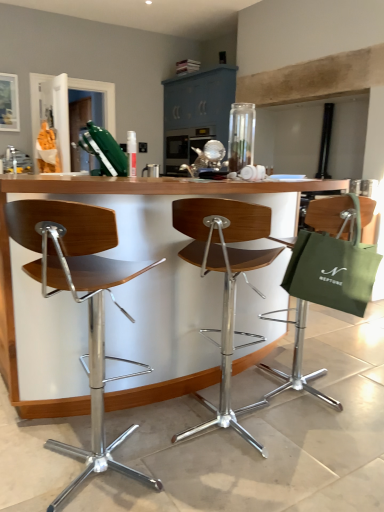
Question: From a real-world perspective, is wooden seat at center, which is counted as the 2th chair, starting from the right, on top of green canvas tote at right?

Choices:
 (A) yes
 (B) no

Answer: (B)

Question: Are wooden seat at center, which is counted as the 2th chair, starting from the right, and green canvas tote at right making contact?

Choices:
 (A) no
 (B) yes

Answer: (A)

Question: Is wooden seat at center, which is counted as the 2th chair, starting from the right, not close to green canvas tote at right?

Choices:
 (A) no
 (B) yes

Answer: (A)

Question: From a real-world perspective, is wooden seat at center, which is counted as the second chair, starting from the left, below green canvas tote at right?

Choices:
 (A) yes
 (B) no

Answer: (A)

Question: Is wooden seat at center, which is counted as the second chair, starting from the left, bigger than green canvas tote at right?

Choices:
 (A) yes
 (B) no

Answer: (A)

Question: Would you say green fabric bag at right, which appears as the first chair when viewed from the right, is to the left or to the right of wooden seat at center, acting as the third chair starting from the right, in the picture?

Choices:
 (A) right
 (B) left

Answer: (A)

Question: Is point (357, 266) positioned closer to the camera than point (26, 246)?

Choices:
 (A) closer
 (B) farther

Answer: (B)

Question: Considering the positions of green fabric bag at right, which appears as the first chair when viewed from the right, and wooden seat at center, positioned as the first chair in left-to-right order, in the image, is green fabric bag at right, which appears as the first chair when viewed from the right, wider or thinner than wooden seat at center, positioned as the first chair in left-to-right order,?

Choices:
 (A) wide
 (B) thin

Answer: (B)

Question: In the image, is green fabric bag at right, which appears as the first chair when viewed from the right, positioned in front of or behind wooden seat at center, positioned as the first chair in left-to-right order?

Choices:
 (A) behind
 (B) front

Answer: (A)

Question: Is green canvas tote at right taller or shorter than woodenmaterial/texturetable at center?

Choices:
 (A) short
 (B) tall

Answer: (A)

Question: Is green canvas tote at right wider or thinner than woodenmaterial/texturetable at center?

Choices:
 (A) thin
 (B) wide

Answer: (A)

Question: Considering the positions of green canvas tote at right and woodenmaterial/texturetable at center in the image, is green canvas tote at right bigger or smaller than woodenmaterial/texturetable at center?

Choices:
 (A) small
 (B) big

Answer: (A)

Question: Visually, is green canvas tote at right positioned to the left or to the right of woodenmaterial/texturetable at center?

Choices:
 (A) left
 (B) right

Answer: (B)

Question: Considering the positions of point (221, 202) and point (97, 366), is point (221, 202) closer or farther from the camera than point (97, 366)?

Choices:
 (A) closer
 (B) farther

Answer: (A)

Question: From a real-world perspective, is wooden seat at center, which is counted as the 2th chair, starting from the right, positioned above or below wooden seat at center, acting as the third chair starting from the right?

Choices:
 (A) below
 (B) above

Answer: (B)